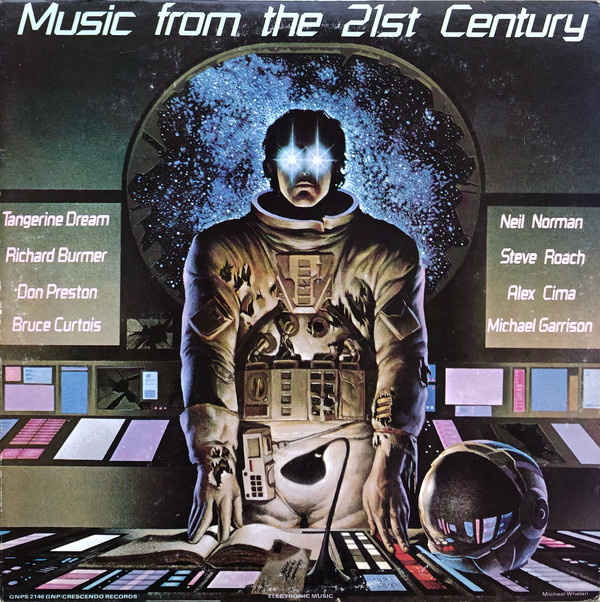
Where is `book`? This screenshot has width=600, height=602. book is located at coordinates point(244,540).